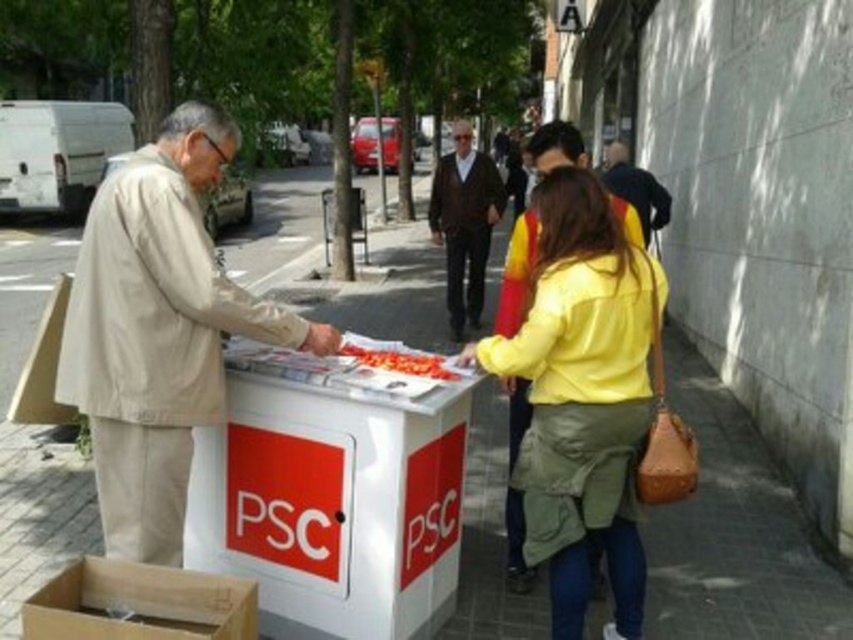
Can you confirm if yellow matte jacket at center is thinner than dark brown sweater at center?

In fact, yellow matte jacket at center might be wider than dark brown sweater at center.

Can you confirm if yellow matte jacket at center is wider than dark brown sweater at center?

Indeed, yellow matte jacket at center has a greater width compared to dark brown sweater at center.

Describe the element at coordinates (583, 397) in the screenshot. I see `yellow matte jacket at center` at that location.

At what (x,y) coordinates should I click in order to perform the action: click on yellow matte jacket at center. Please return your answer as a coordinate pair (x, y). Image resolution: width=853 pixels, height=640 pixels. Looking at the image, I should click on (583, 397).

Which of these two, beige fabric jacket at left or yellow matte jacket at center, stands shorter?

With less height is beige fabric jacket at left.

Can you confirm if beige fabric jacket at left is positioned below yellow matte jacket at center?

Incorrect, beige fabric jacket at left is not positioned below yellow matte jacket at center.

Is point (103, 346) positioned behind point (583, 484)?

No, it is in front of (583, 484).

This screenshot has width=853, height=640. In order to click on beige fabric jacket at left in this screenshot , I will do `click(158, 330)`.

Does white smooth pavement at center have a larger size compared to brown cardboard box at lower left?

Yes.

Between white smooth pavement at center and brown cardboard box at lower left, which one has more height?

white smooth pavement at center is taller.

Who is more distant from viewer, (x=82, y=509) or (x=73, y=602)?

The point (x=82, y=509) is behind.

Locate an element on the screen. Image resolution: width=853 pixels, height=640 pixels. white smooth pavement at center is located at coordinates (734, 532).